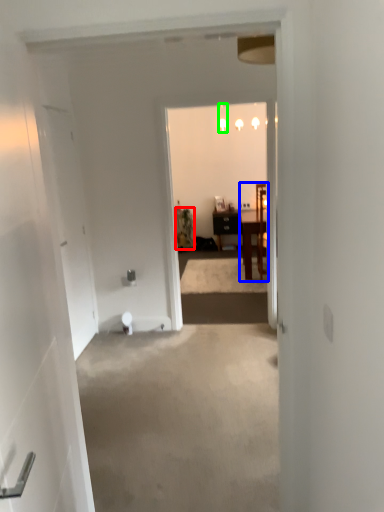
Question: Which object is positioned closest to houseplant (highlighted by a red box)? Select from chair (highlighted by a blue box) and lamp (highlighted by a green box).

Choices:
 (A) chair
 (B) lamp

Answer: (A)